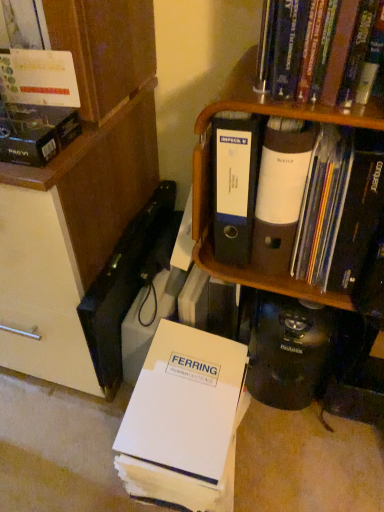
At what (x,y) coordinates should I click in order to perform the action: click on spots to the right of white paper folder at lower center, placed as the 4th book when sorted from top to bottom. Please return your answer as a coordinate pair (x, y). Image resolution: width=384 pixels, height=512 pixels. Looking at the image, I should click on (281, 468).